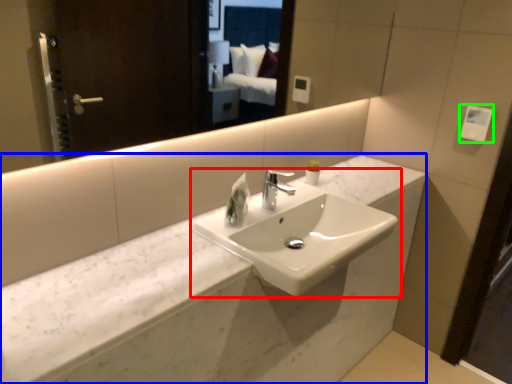
Question: Which is nearer to the sink (highlighted by a red box)? counter (highlighted by a blue box) or hand dryer (highlighted by a green box).

Choices:
 (A) counter
 (B) hand dryer

Answer: (A)